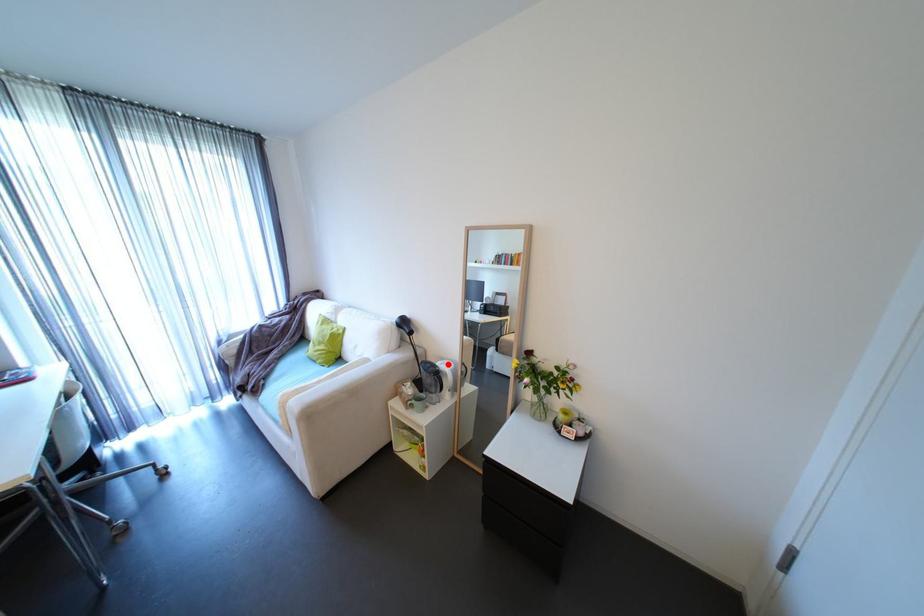
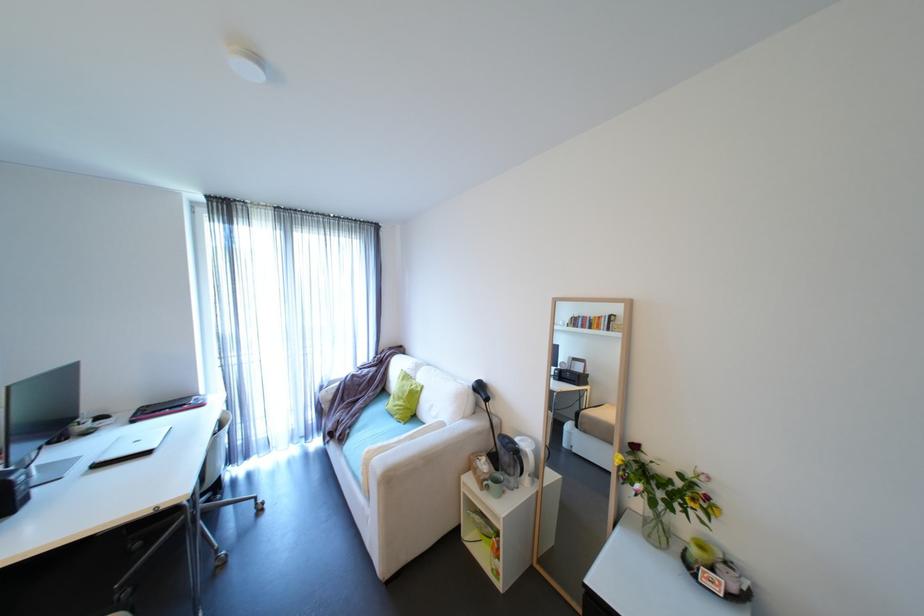
Question: I am providing you with two images of the same scene from different viewpoints. A red point is marked on the first image. Is the red point's position out of view in image 2?

Choices:
 (A) Yes
 (B) No

Answer: (B)